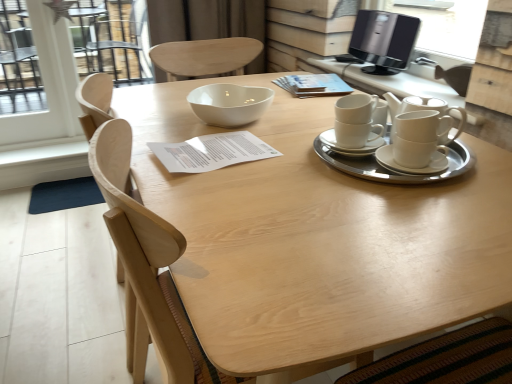
Locate an element on the screen. This screenshot has height=384, width=512. vacant space to the left of white ceramic tea set at right is located at coordinates (272, 168).